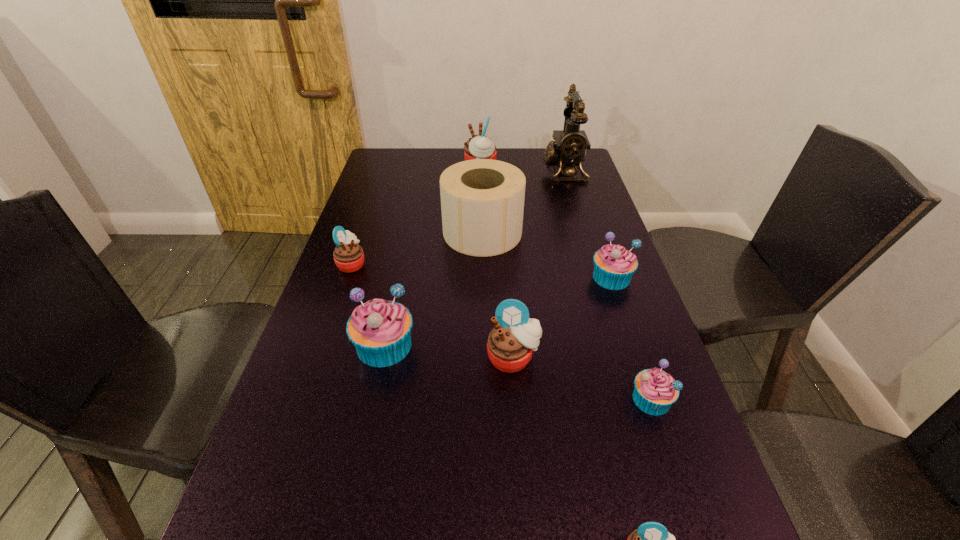
Identify the location of free space located on the front-facing side of the second biggest pink muffin. (524, 516).

The image size is (960, 540). I want to click on blank space located 0.330m on the front-facing side of the leftmost object, so click(x=490, y=264).

Where is `vacant space located 0.090m on the left of the farthest blue muffin`? vacant space located 0.090m on the left of the farthest blue muffin is located at coordinates (555, 278).

Locate an element on the screen. This screenshot has width=960, height=540. free region located 0.130m on the left of the smallest blue muffin is located at coordinates (564, 400).

I want to click on telephone situated at the far edge, so click(x=569, y=147).

Find the location of a particular element. This screenshot has width=960, height=540. muffin that is at the far edge is located at coordinates (478, 147).

Where is `telephone situated at the right edge`? telephone situated at the right edge is located at coordinates (569, 147).

Identify the location of object located at the far right corner. This screenshot has width=960, height=540. (569, 147).

The width and height of the screenshot is (960, 540). Identify the location of vacant space at the far edge. (524, 174).

Find the location of a particular element. The image size is (960, 540). vacant space at the left edge is located at coordinates (366, 246).